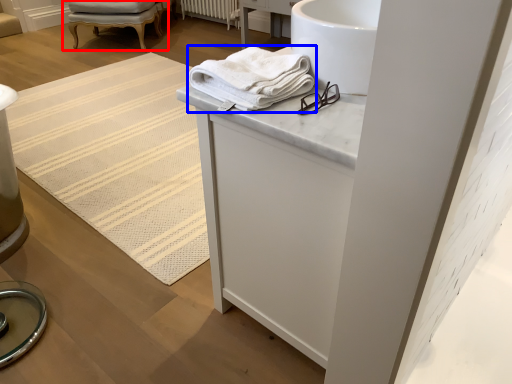
Question: Among these objects, which one is nearest to the camera, chair (highlighted by a red box) or towel (highlighted by a blue box)?

Choices:
 (A) chair
 (B) towel

Answer: (B)